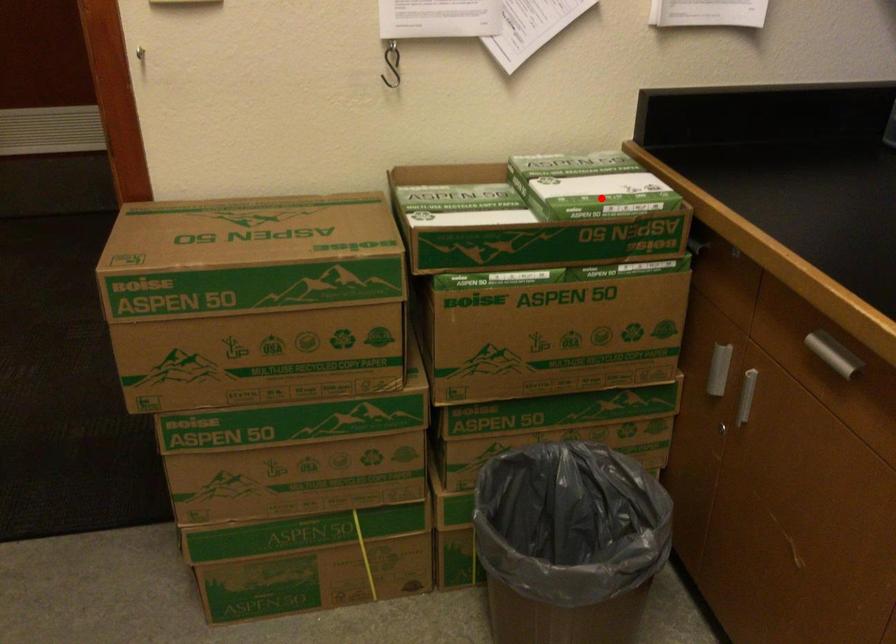
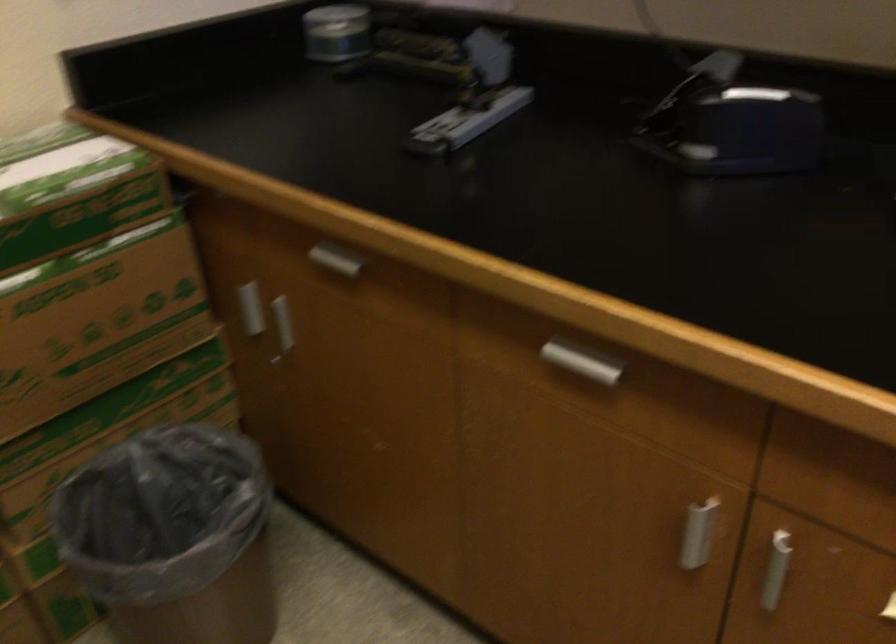
In the second image, find the point that corresponds to the highlighted location in the first image.

(67, 176)